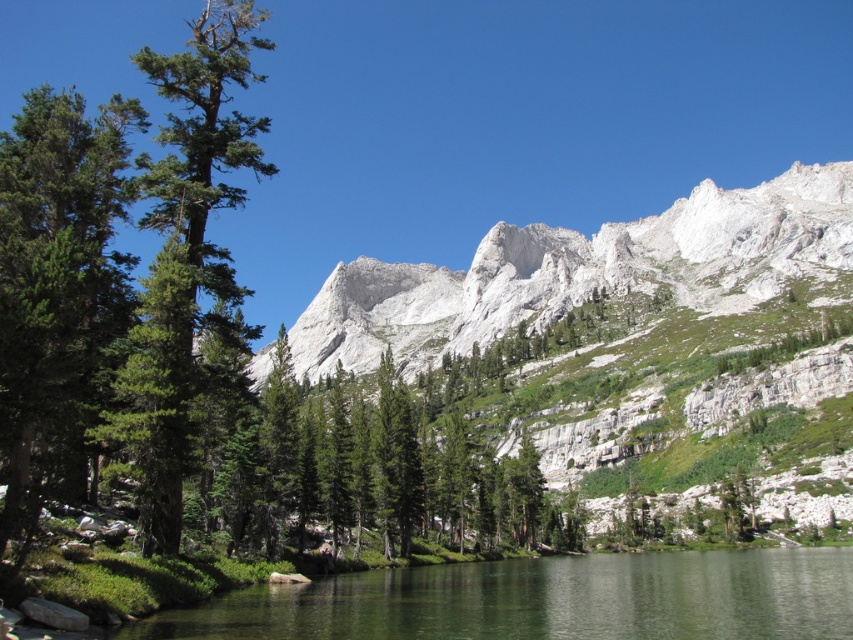
Question: Is clear water at center to the right of green matte tree at left from the viewer's perspective?

Choices:
 (A) no
 (B) yes

Answer: (B)

Question: Does green matte tree at left appear under green textured pine tree at left?

Choices:
 (A) no
 (B) yes

Answer: (B)

Question: Can you confirm if green matte tree at left is wider than green textured pine tree at left?

Choices:
 (A) yes
 (B) no

Answer: (B)

Question: Among these points, which one is nearest to the camera?

Choices:
 (A) (358, 282)
 (B) (834, 582)
 (C) (55, 390)
 (D) (219, 83)

Answer: (C)

Question: Which point is closer to the camera?

Choices:
 (A) clear water at center
 (B) green matte tree at left
 (C) white rocky mountain at upper center
 (D) green textured pine tree at left

Answer: (A)

Question: Which object is closer to the camera taking this photo?

Choices:
 (A) green textured pine tree at left
 (B) white rocky mountain at upper center

Answer: (A)